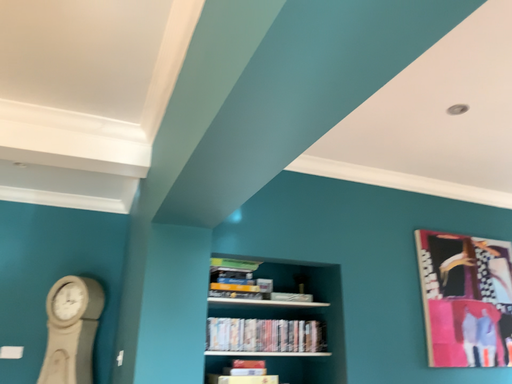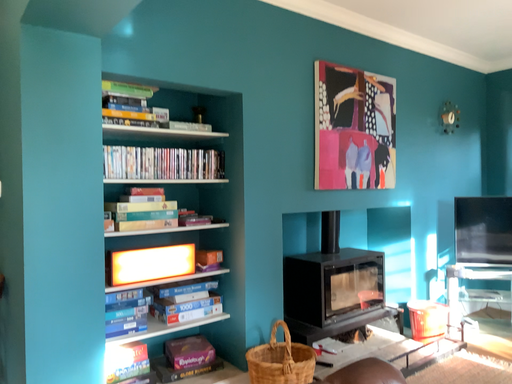
Question: Which way did the camera rotate in the video?

Choices:
 (A) rotated right
 (B) rotated left

Answer: (A)